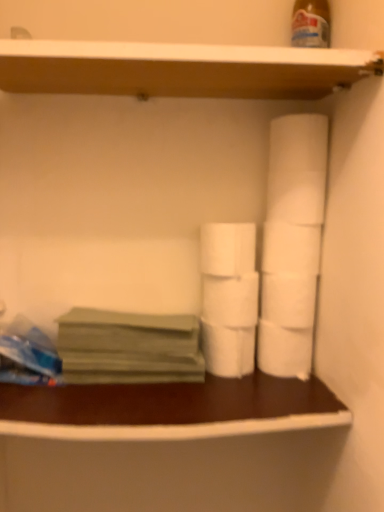
Question: Considering the positions of point (200, 380) and point (322, 79), is point (200, 380) closer or farther from the camera than point (322, 79)?

Choices:
 (A) closer
 (B) farther

Answer: (B)

Question: Is green matte paper at left taller or shorter than wooden at upper center?

Choices:
 (A) short
 (B) tall

Answer: (B)

Question: Estimate the real-world distances between objects in this image. Which object is closer to the wooden at upper center?

Choices:
 (A) white matte toilet paper at center, which ranks as the fourth toilet paper in bottom-to-top order
 (B) brown wood counter at lower center
 (C) white matte toilet paper at center, positioned as the 5th toilet paper in top-to-bottom order
 (D) green matte paper at left
 (E) white matte toilet paper at right, placed as the 4th toilet paper when sorted from top to bottom

Answer: (A)

Question: Estimate the real-world distances between objects in this image. Which object is closer to the white matte toilet paper at right, placed as the 4th toilet paper when sorted from top to bottom?

Choices:
 (A) white matte toilet paper at right, the 1th toilet paper when ordered from bottom to top
 (B) white matte toilet paper at center-right, which is the first toilet paper in top-to-bottom order
 (C) white matte toilet paper at center, which ranks as the fourth toilet paper in bottom-to-top order
 (D) green matte paper at left
 (E) white matte toilet paper at center, positioned as the 5th toilet paper in top-to-bottom order

Answer: (A)